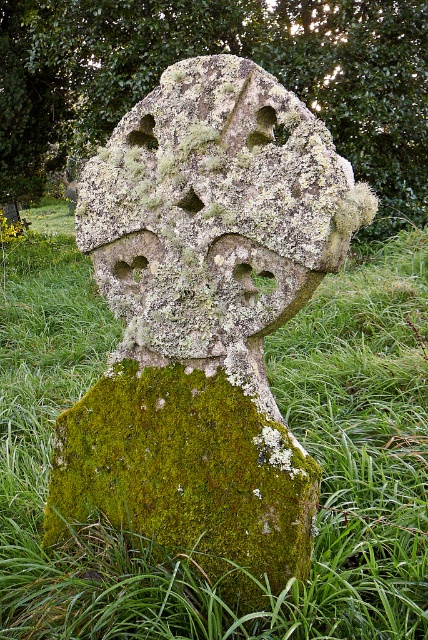
Does point (208, 186) come in front of point (107, 436)?

Yes, it is in front of point (107, 436).

Can you confirm if lichen-covered stone cross at center is thinner than green mossy stone at lower center?

Incorrect, lichen-covered stone cross at center's width is not less than green mossy stone at lower center's.

Which is behind, point (160, 131) or point (165, 541)?

Positioned behind is point (160, 131).

Locate an element on the screen. This screenshot has width=428, height=640. lichen-covered stone cross at center is located at coordinates (214, 216).

Find the location of `green mossy stone cross at center`. green mossy stone cross at center is located at coordinates (205, 320).

Is green mossy stone cross at center smaller than green mossy stone at lower center?

Actually, green mossy stone cross at center might be larger than green mossy stone at lower center.

Is point (89, 492) behind point (177, 396)?

That is True.

Find the location of a particular element. This screenshot has height=640, width=428. green mossy stone cross at center is located at coordinates (205, 320).

Who is lower down, green mossy stone cross at center or lichen-covered stone cross at center?

green mossy stone cross at center is below.

At what (x,y) coordinates should I click in order to perform the action: click on green mossy stone cross at center. Please return your answer as a coordinate pair (x, y). This screenshot has height=640, width=428. Looking at the image, I should click on (205, 320).

Identify the location of green mossy stone cross at center. pyautogui.click(x=205, y=320).